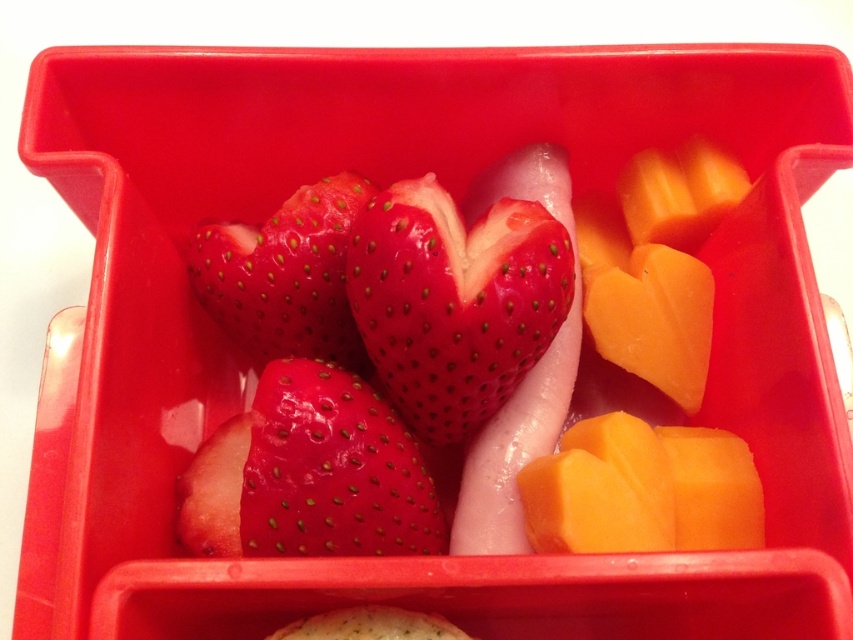
Question: Can you confirm if shiny red strawberries at center is bigger than shiny red strawberry at center?

Choices:
 (A) yes
 (B) no

Answer: (A)

Question: Observing the image, what is the correct spatial positioning of shiny red strawberry at center in reference to glossy red strawberry at center?

Choices:
 (A) above
 (B) below

Answer: (B)

Question: Does smooth red strawberry at center appear on the right side of glossy red strawberry at center?

Choices:
 (A) no
 (B) yes

Answer: (B)

Question: Which of the following is the closest to the observer?

Choices:
 (A) shiny red strawberries at center
 (B) shiny red strawberry at center
 (C) glossy red strawberry at center
 (D) smooth red strawberry at center

Answer: (D)

Question: Among these points, which one is nearest to the camera?

Choices:
 (A) (350, 262)
 (B) (328, 272)
 (C) (302, 472)

Answer: (C)

Question: Based on their relative distances, which object is farther from the smooth red strawberry at center?

Choices:
 (A) shiny red strawberries at center
 (B) glossy red strawberry at center

Answer: (B)